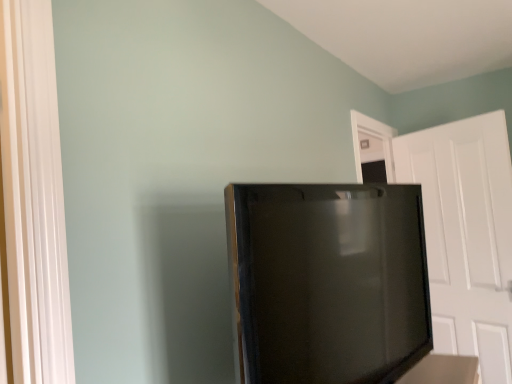
The width and height of the screenshot is (512, 384). In order to click on white matte door at right in this screenshot , I will do `click(466, 235)`.

What do you see at coordinates (466, 235) in the screenshot? I see `white matte door at right` at bounding box center [466, 235].

What is the approximate height of black glossy refrigerator at center?

68.39 centimeters.

In the scene shown: Measure the distance between point (362,317) and camera.

The distance of point (362,317) from camera is 1.19 meters.

Image resolution: width=512 pixels, height=384 pixels. Describe the element at coordinates (328, 282) in the screenshot. I see `black glossy refrigerator at center` at that location.

Find the location of a particular element. black glossy refrigerator at center is located at coordinates (328, 282).

Find the location of a particular element. white matte door at right is located at coordinates (466, 235).

Is white matte door at right to the left or to the right of black glossy refrigerator at center in the image?

Clearly, white matte door at right is on the right of black glossy refrigerator at center in the image.

Does white matte door at right come behind black glossy refrigerator at center?

That is True.

Considering the positions of points (462, 219) and (332, 378), is point (462, 219) closer to camera compared to point (332, 378)?

That is False.

From the image's perspective, is white matte door at right on top of black glossy refrigerator at center?

No.

From a real-world perspective, which is physically above, white matte door at right or black glossy refrigerator at center?

In real-world perspective, black glossy refrigerator at center is above.

Between white matte door at right and black glossy refrigerator at center, which one has smaller width?

Thinner between the two is white matte door at right.

Does white matte door at right have a greater height compared to black glossy refrigerator at center?

Yes.

In terms of size, does white matte door at right appear bigger or smaller than black glossy refrigerator at center?

Considering their sizes, white matte door at right takes up less space than black glossy refrigerator at center.

Would you say white matte door at right is inside or outside black glossy refrigerator at center?

white matte door at right exists outside the volume of black glossy refrigerator at center.

Is white matte door at right not near black glossy refrigerator at center?

Yes, white matte door at right and black glossy refrigerator at center are located far from each other.

Is white matte door at right facing away from black glossy refrigerator at center?

No.

Where is `refrigerator lying on the left of white matte door at right`? This screenshot has width=512, height=384. refrigerator lying on the left of white matte door at right is located at coordinates (328, 282).

Which is more to the left, black glossy refrigerator at center or white matte door at right?

black glossy refrigerator at center.

Is the position of black glossy refrigerator at center less distant than that of white matte door at right?

Yes, black glossy refrigerator at center is in front of white matte door at right.

Between point (281, 228) and point (504, 213), which one is positioned in front?

Positioned in front is point (281, 228).

From the image's perspective, is black glossy refrigerator at center above or below white matte door at right?

Clearly, from the image's perspective, black glossy refrigerator at center is above white matte door at right.

Consider the image. From a real-world perspective, which is physically below, black glossy refrigerator at center or white matte door at right?

white matte door at right, from a real-world perspective.

Between black glossy refrigerator at center and white matte door at right, which one has larger width?

Wider between the two is black glossy refrigerator at center.

Considering the relative sizes of black glossy refrigerator at center and white matte door at right in the image provided, is black glossy refrigerator at center taller than white matte door at right?

No, black glossy refrigerator at center is not taller than white matte door at right.

Who is smaller, black glossy refrigerator at center or white matte door at right?

white matte door at right is smaller.

Is white matte door at right located within black glossy refrigerator at center?

No, white matte door at right is not a part of black glossy refrigerator at center.

Is black glossy refrigerator at center next to white matte door at right and touching it?

No, black glossy refrigerator at center is not next to white matte door at right.

Based on the photo, is white matte door at right at the back of black glossy refrigerator at center?

black glossy refrigerator at center is not turned away from white matte door at right.

What's the angular difference between black glossy refrigerator at center and white matte door at right's facing directions?

black glossy refrigerator at center and white matte door at right are facing 108 degrees away from each other.

Locate an element on the screen. This screenshot has width=512, height=384. refrigerator above the white matte door at right (from a real-world perspective) is located at coordinates (328, 282).

Where is `refrigerator lying on the left of white matte door at right`? Image resolution: width=512 pixels, height=384 pixels. refrigerator lying on the left of white matte door at right is located at coordinates (328, 282).

Locate an element on the screen. Image resolution: width=512 pixels, height=384 pixels. refrigerator above the white matte door at right (from the image's perspective) is located at coordinates (328, 282).